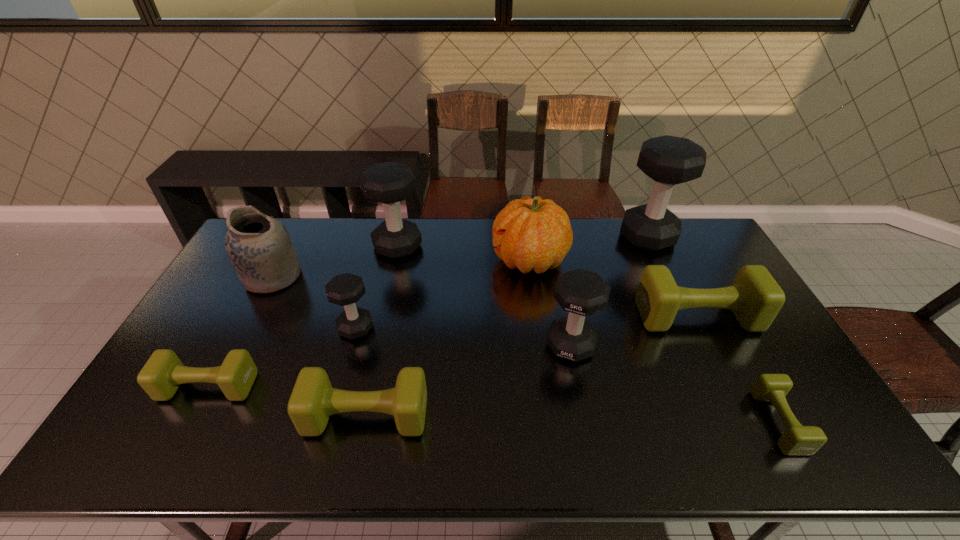
At what (x,y) coordinates should I click in order to perform the action: click on the third shortest dumbbell. Please return your answer as a coordinate pair (x, y). This screenshot has width=960, height=540. Looking at the image, I should click on (313, 399).

The width and height of the screenshot is (960, 540). Find the location of `the third shortest object`. the third shortest object is located at coordinates (313, 399).

You are a GUI agent. You are given a task and a screenshot of the screen. Output one action in this format:
    pyautogui.click(x=<x>, y=<y>)
    Task: Click on the seventh tallest dumbbell
    This screenshot has width=960, height=540.
    Given the screenshot: What is the action you would take?
    pyautogui.click(x=161, y=376)

Where is `the leftmost dumbbell`? This screenshot has height=540, width=960. the leftmost dumbbell is located at coordinates (161, 376).

Identify the location of the shortest dumbbell. This screenshot has height=540, width=960. (797, 440).

This screenshot has width=960, height=540. Find the location of `the smallest olive dumbbell`. the smallest olive dumbbell is located at coordinates coord(797,440).

At what (x,y) coordinates should I click in order to perform the action: click on free space located 0.120m on the right of the rightmost gray dumbbell. Please return your answer as a coordinate pair (x, y). The image size is (960, 540). Looking at the image, I should click on (708, 236).

At what (x,y) coordinates should I click in order to perform the action: click on free location located 0.350m on the right of the third smallest gray dumbbell. Please return your answer as a coordinate pair (x, y). The width and height of the screenshot is (960, 540). Looking at the image, I should click on pos(518,246).

Image resolution: width=960 pixels, height=540 pixels. In order to click on blank space located 0.130m on the carved face of the orange pumpkin in this screenshot , I will do `click(455, 260)`.

You are a GUI agent. You are given a task and a screenshot of the screen. Output one action in this format:
    pyautogui.click(x=<x>, y=<y>)
    Task: Click on the vacant space situated 0.330m on the carved face of the orange pumpkin
    Image resolution: width=960 pixels, height=540 pixels.
    Given the screenshot: What is the action you would take?
    pyautogui.click(x=398, y=260)